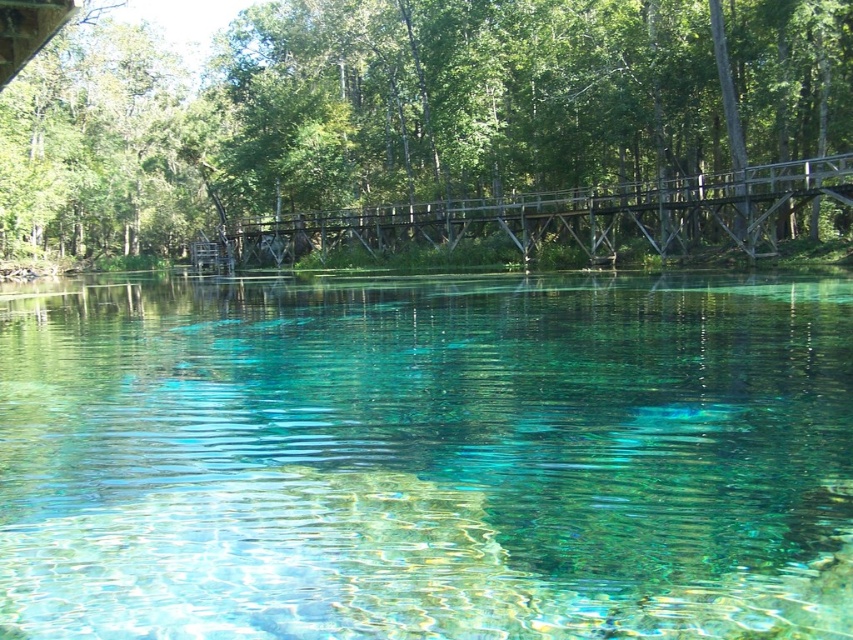
You are standing at the edge of the clear glassy water at center and want to walk to the green matte bridge at upper center. Which direction should you move to reach it?

You should move forward because the green matte bridge at upper center is further away from you than the clear glassy water at center, so moving toward the bridge would require going in the direction away from the water towards the bridge.

You are standing at the edge of the water in the serene natural scene and want to walk towards the wooden bridge. There are two points marked on the bridge, point1 at coordinates point(387, 83) and point2 at coordinates point(322, 259). Which point will you reach first as you approach the bridge?

Point point(387, 83) is closer to you than point point(322, 259), so you will reach point point(387, 83) first as you approach the bridge.

You are standing at the edge of the scene and want to cross the wooden bridge to reach the other side. The clear glassy water at center is in your path. Based on its coordinates, is the water located directly under the bridge or to the side of it?

The clear glassy water at center is located at coordinates point (426, 456). Since the bridge spans horizontally across the frame, the water at center is directly under the bridge.